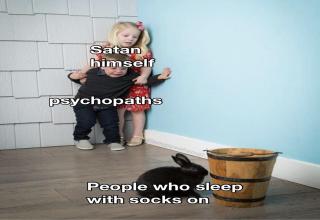
The width and height of the screenshot is (320, 220). What are the coordinates of `panels` in the screenshot? It's located at (35, 19).